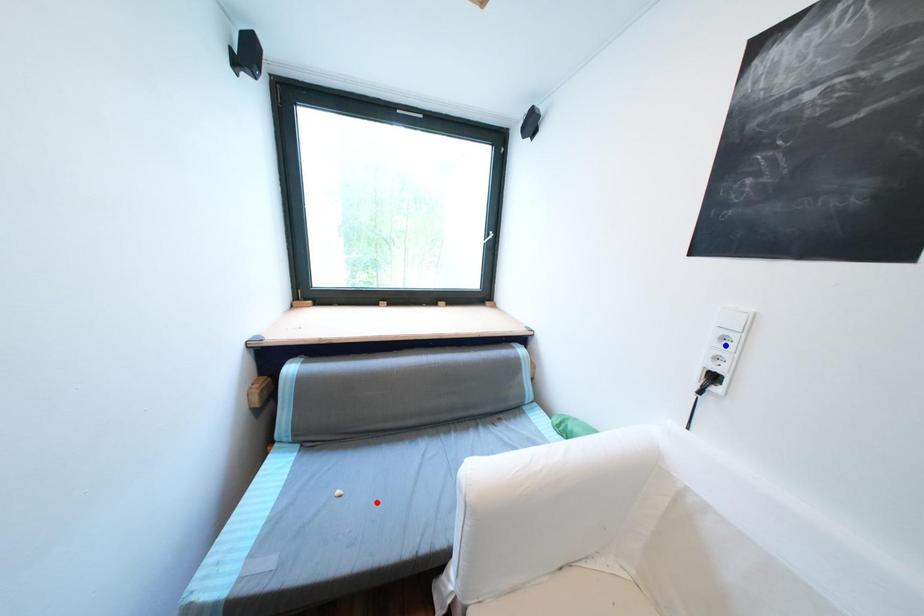
Question: In the image, two points are highlighted. Which point is nearer to the camera? Reply with the corresponding letter.

Choices:
 (A) blue point
 (B) red point

Answer: (A)